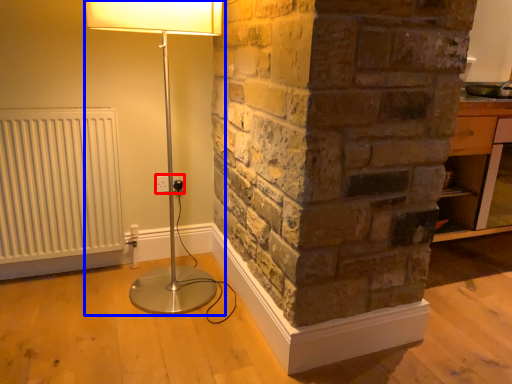
Question: Among these objects, which one is nearest to the camera, electric outlet (highlighted by a red box) or lamp (highlighted by a blue box)?

Choices:
 (A) electric outlet
 (B) lamp

Answer: (B)